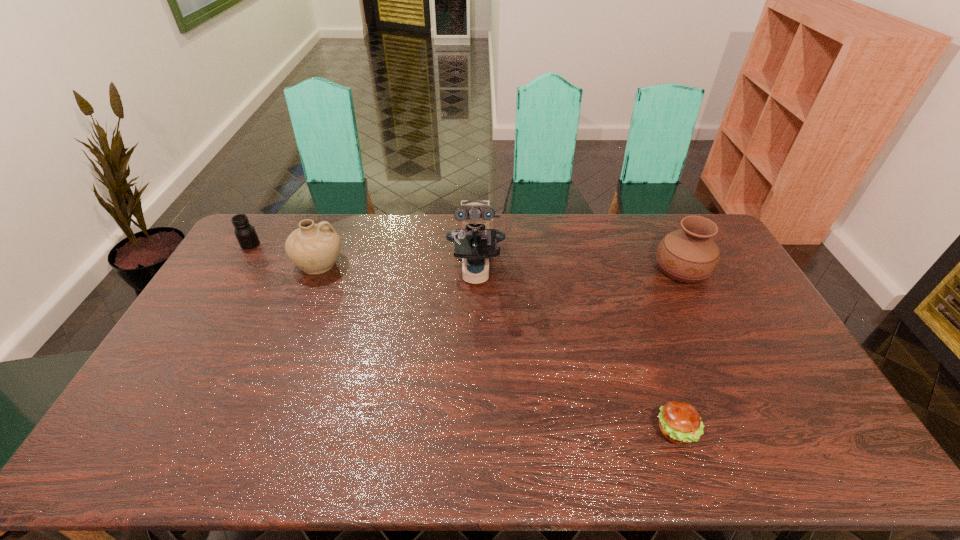
Find the location of a particular element. This screenshot has width=960, height=540. the third object from left to right is located at coordinates point(475,241).

Image resolution: width=960 pixels, height=540 pixels. Find the location of `microscope`. microscope is located at coordinates (475, 241).

Where is `urn`? urn is located at coordinates (689, 255).

Find the location of a particular element. The height and width of the screenshot is (540, 960). pottery is located at coordinates pyautogui.click(x=314, y=248).

Locate an element on the screen. The width and height of the screenshot is (960, 540). jar is located at coordinates (245, 233).

Identify the location of the fourth tallest object. (245, 233).

You are a GUI agent. You are given a task and a screenshot of the screen. Output one action in this format:
    pyautogui.click(x=<x>, y=<y>)
    Task: Click on the fourth object from left to right
    This screenshot has height=540, width=960.
    Given the screenshot: What is the action you would take?
    pyautogui.click(x=680, y=422)

In order to click on the nearest object in this screenshot , I will do `click(680, 422)`.

The width and height of the screenshot is (960, 540). Find the location of `free region located through the eyepieces of the tallest object`. free region located through the eyepieces of the tallest object is located at coordinates (475, 348).

Image resolution: width=960 pixels, height=540 pixels. I want to click on vacant space positioned on the left of the urn, so click(x=584, y=268).